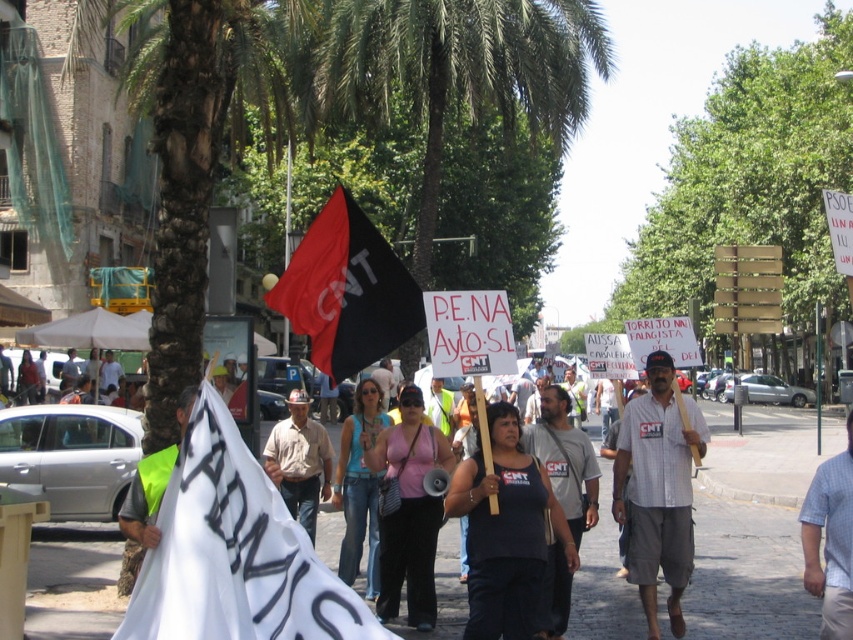
You are a photographer trying to capture the protest scene. You want to focus on the white cotton shirt at center and the light blue checkered shirt at center. Which one is positioned to the left of the other?

The white cotton shirt at center is to the left of the light blue checkered shirt at center.

You are a photographer trying to capture the protest scene. You notice the black matte flag at center and the light blue checkered shirt at center. Which object would appear shorter in your photo?

The black matte flag at center is not as tall as the light blue checkered shirt at center, so it would appear shorter in the photo.

You are a photographer trying to capture the central figure in the protest. You notice the pink fabric tank top at center and the brown cotton shirt at center. Which clothing item is visible on top?

The pink fabric tank top at center is positioned over the brown cotton shirt at center, so the pink fabric tank top at center is visible on top.